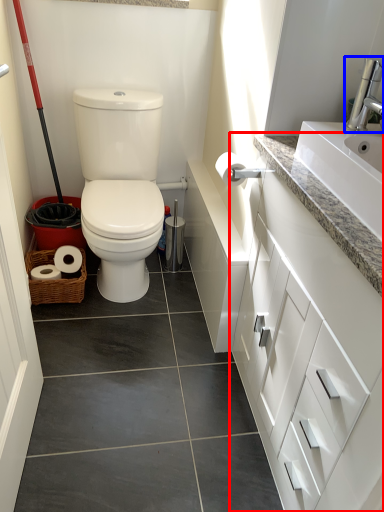
Question: Among these objects, which one is nearest to the camera, bathroom cabinet (highlighted by a red box) or faucet (highlighted by a blue box)?

Choices:
 (A) bathroom cabinet
 (B) faucet

Answer: (A)